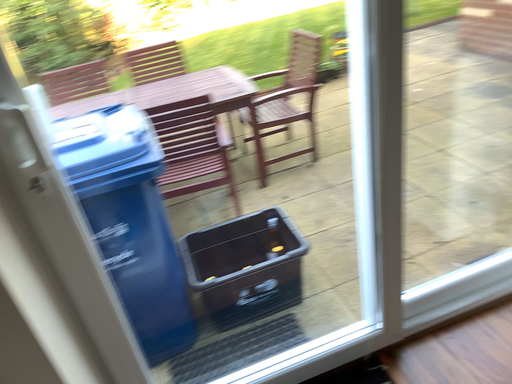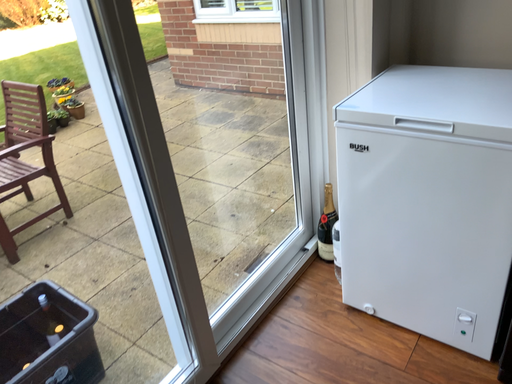
Question: Which way did the camera rotate in the video?

Choices:
 (A) rotated upward
 (B) rotated downward

Answer: (A)